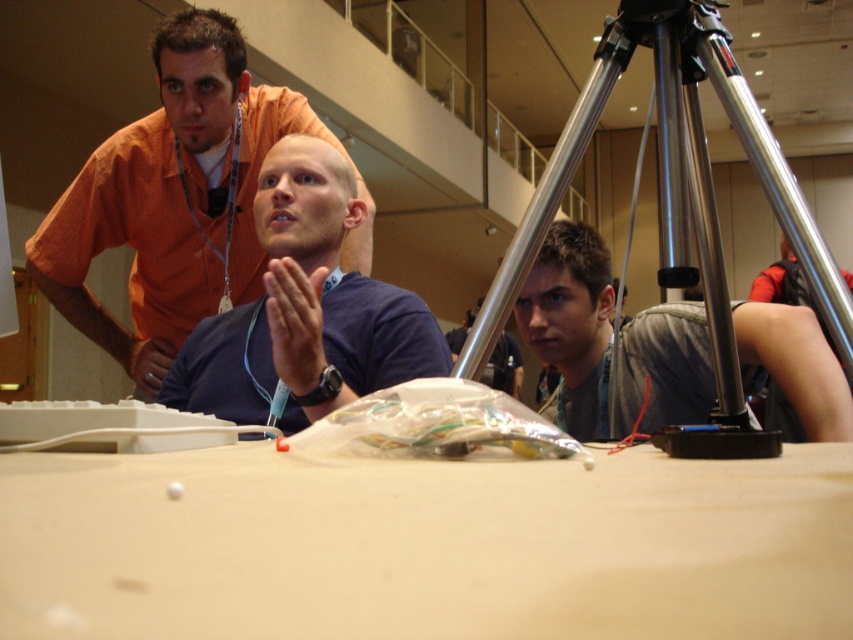
Looking at this image, which is below, orange shirt at upper left or gray fabric shirt at right?

gray fabric shirt at right is lower down.

Between point (219, 24) and point (556, 332), which one is positioned in front?

Point (556, 332) is more forward.

This screenshot has width=853, height=640. What do you see at coordinates (171, 198) in the screenshot?
I see `orange shirt at upper left` at bounding box center [171, 198].

The image size is (853, 640). In order to click on orange shirt at upper left in this screenshot , I will do pyautogui.click(x=171, y=198).

Can you confirm if silver metallic tripod at center is smaller than orange shirt at upper left?

Yes.

Between silver metallic tripod at center and orange shirt at upper left, which one has more height?

orange shirt at upper left

This screenshot has width=853, height=640. What do you see at coordinates (672, 240) in the screenshot?
I see `silver metallic tripod at center` at bounding box center [672, 240].

Find the location of a particular element. The width and height of the screenshot is (853, 640). silver metallic tripod at center is located at coordinates (672, 240).

Can you confirm if orange shirt at upper left is bigger than blue matte shirt at center?

Correct, orange shirt at upper left is larger in size than blue matte shirt at center.

Is point (296, 128) closer to camera compared to point (265, 323)?

No, it is behind (265, 323).

At what (x,y) coordinates should I click in order to perform the action: click on orange shirt at upper left. Please return your answer as a coordinate pair (x, y). Looking at the image, I should click on (171, 198).